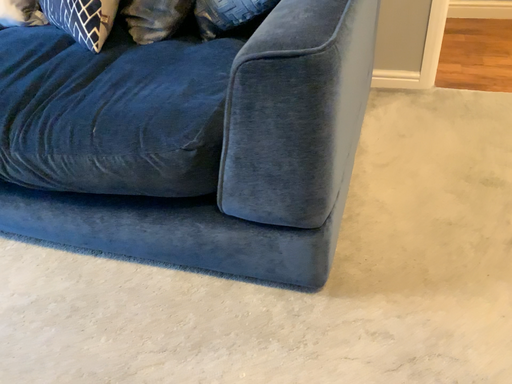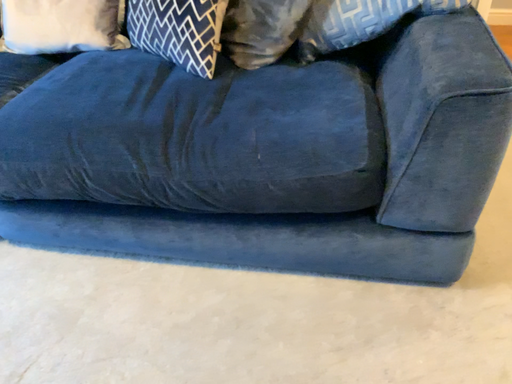
Question: Which way did the camera rotate in the video?

Choices:
 (A) rotated right
 (B) rotated left

Answer: (A)